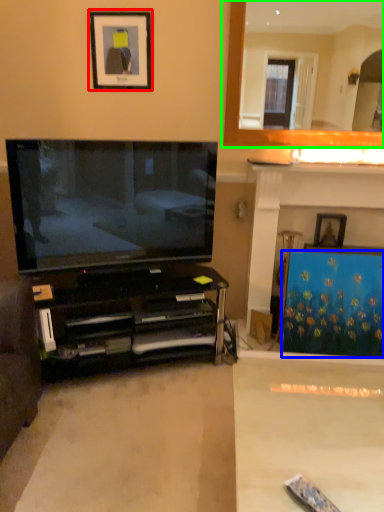
Question: Based on their relative distances, which object is nearer to picture frame (highlighted by a red box)? Choose from curtain (highlighted by a blue box) and fireplace (highlighted by a green box).

Choices:
 (A) curtain
 (B) fireplace

Answer: (B)